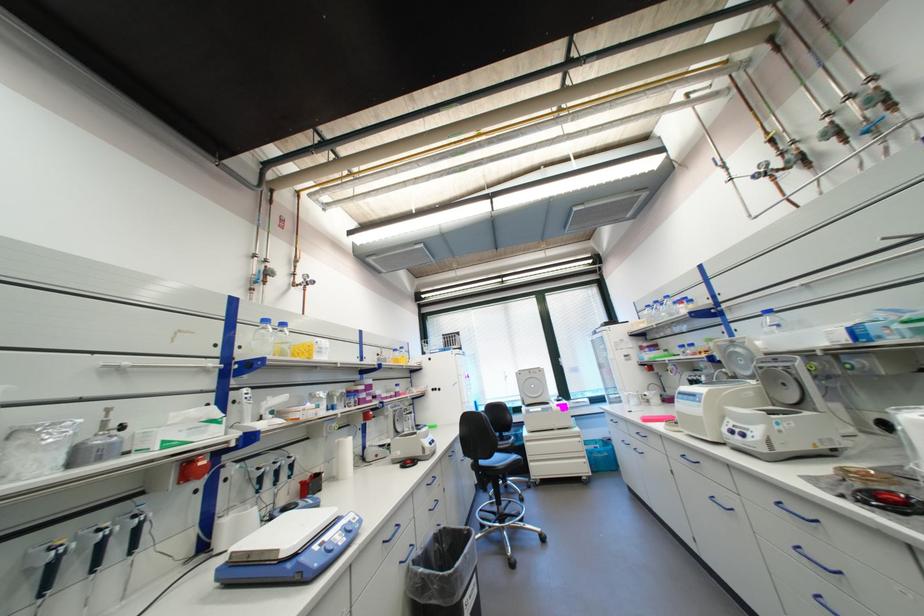
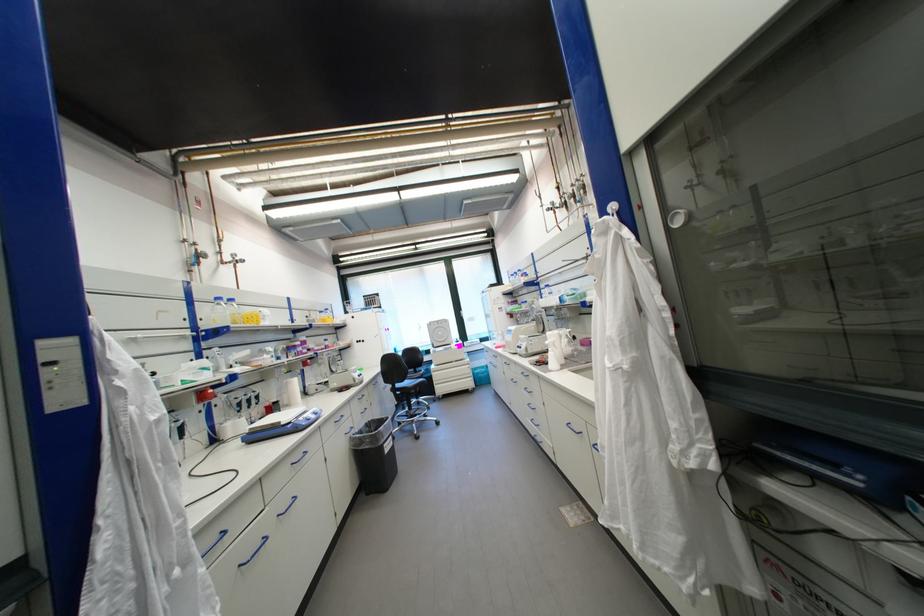
Question: What movement of the cameraman would produce the second image?

Choices:
 (A) Left
 (B) Right
 (C) Forward
 (D) Backward

Answer: (D)